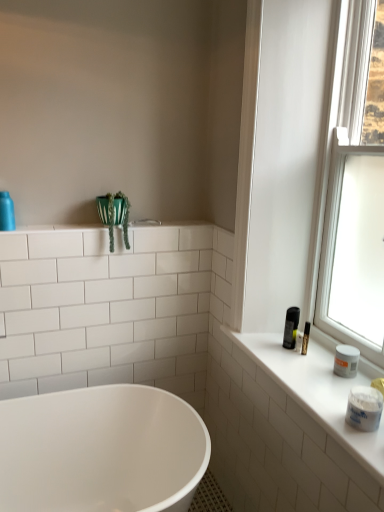
Question: Is transparent glass window at upper right wider or thinner than green fabric plant at upper left?

Choices:
 (A) wide
 (B) thin

Answer: (B)

Question: Based on their sizes in the image, would you say transparent glass window at upper right is bigger or smaller than green fabric plant at upper left?

Choices:
 (A) small
 (B) big

Answer: (B)

Question: Which object is the farthest from the white glossy shelf at upper left?

Choices:
 (A) green fabric plant at upper left
 (B) matte blue bottle at upper left, the first toiletry viewed from the top
 (C) white glossy bathtub at lower center
 (D) white matte counter top at right
 (E) white matte jar at right, acting as the first toiletry starting from the right

Answer: (E)

Question: Estimate the real-world distances between objects in this image. Which object is farther from the green fabric plant at upper left?

Choices:
 (A) transparent glass window at upper right
 (B) white matte counter top at right
 (C) matte blue bottle at upper left, which is counted as the second toiletry, starting from the right
 (D) white matte jar at right, which is the first toiletry from bottom to top
 (E) white glossy bathtub at lower center

Answer: (D)